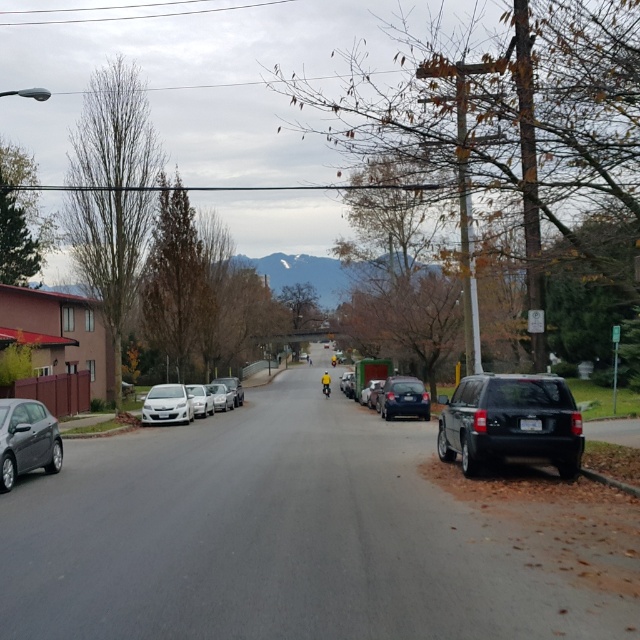
You are a delivery driver who needs to park your vehicle between the matte black car at left and the shiny dark blue sedan at center. Considering their sizes, which vehicle should you position closer to avoid blocking the driveway?

Since the matte black car at left is smaller than the shiny dark blue sedan at center, you should position the shiny dark blue sedan at center closer to the driveway to avoid blocking it, as its larger size provides more space between the smaller matte black car at left and the driveway.

You are a delivery driver who needs to park your van between the black matte suv at right and the satin silver sedan at left. Your van is 15 feet long. Can you fit your van between them without overlapping either vehicle?

The black matte suv at right and the satin silver sedan at left are 59.58 feet apart from each other. Since your van is only 15 feet long, there is sufficient space to park it between them without overlapping either vehicle.